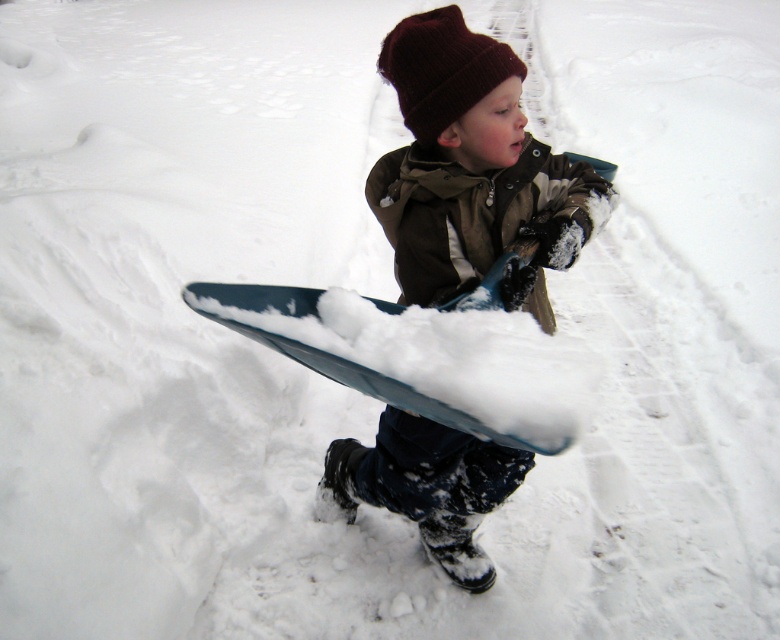
Is burgundy knit beanie at upper center to the left of blue plastic snowboard at center from the viewer's perspective?

No, burgundy knit beanie at upper center is not to the left of blue plastic snowboard at center.

Is burgundy knit beanie at upper center smaller than blue plastic snowboard at center?

Correct, burgundy knit beanie at upper center occupies less space than blue plastic snowboard at center.

Where is `burgundy knit beanie at upper center`? This screenshot has width=780, height=640. burgundy knit beanie at upper center is located at coordinates (441, 68).

Can you confirm if matte blue sled at center is wider than burgundy knit beanie at upper center?

Yes.

Which is more to the right, matte blue sled at center or burgundy knit beanie at upper center?

matte blue sled at center is more to the right.

Locate an element on the screen. matte blue sled at center is located at coordinates (473, 170).

Is point (427, 19) positioned before point (292, 300)?

No, (427, 19) is further to viewer.

What do you see at coordinates (473, 170) in the screenshot? I see `matte blue sled at center` at bounding box center [473, 170].

Is point (546, 324) less distant than point (456, 426)?

That is False.

Image resolution: width=780 pixels, height=640 pixels. Identify the location of matte blue sled at center. (473, 170).